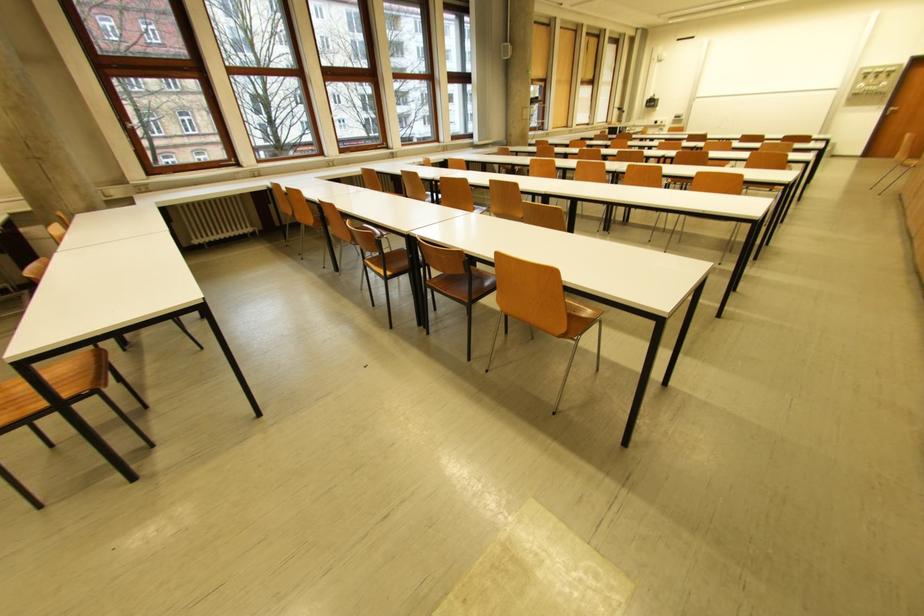
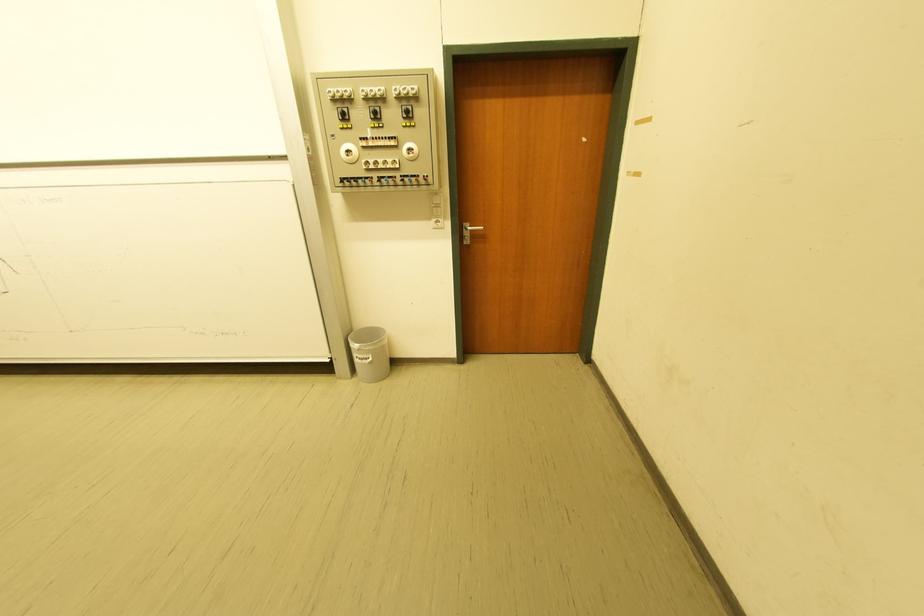
Find the pixel in the second image that matches the point at 869,78 in the first image.

(342, 116)